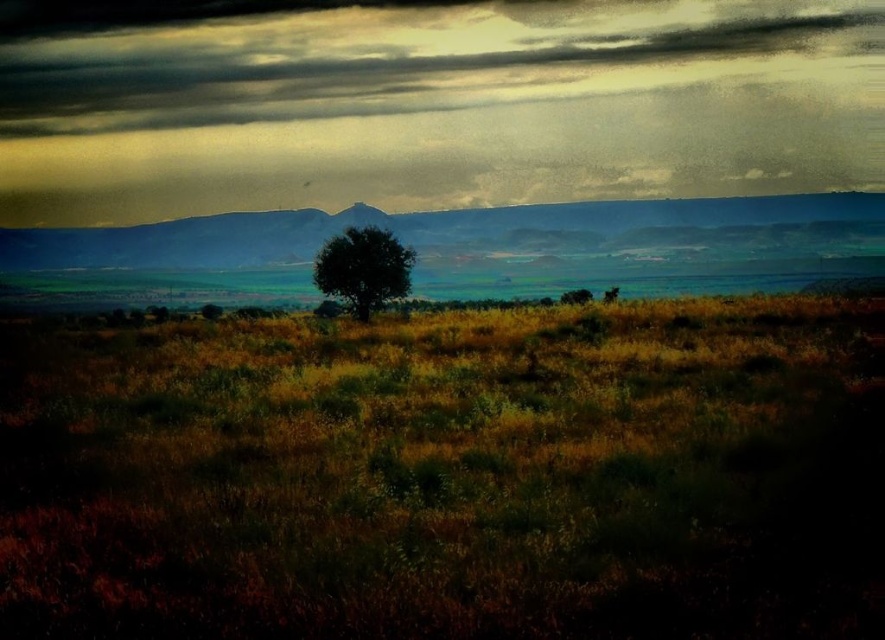
Question: Can you confirm if cloudy textured sky at upper center is positioned to the right of green matte tree at center?

Choices:
 (A) yes
 (B) no

Answer: (B)

Question: Which object is positioned closest to the dull blue mountain at center?

Choices:
 (A) green leafy tree at center
 (B) cloudy textured sky at upper center
 (C) green matte tree at center

Answer: (B)

Question: Can you confirm if cloudy textured sky at upper center is bigger than dull blue mountain at center?

Choices:
 (A) yes
 (B) no

Answer: (A)

Question: Is green leafy tree at center to the right of green matte tree at center from the viewer's perspective?

Choices:
 (A) yes
 (B) no

Answer: (B)

Question: Which point appears closest to the camera in this image?

Choices:
 (A) (368, 225)
 (B) (221, 227)
 (C) (210, 42)

Answer: (A)

Question: Which of the following is the farthest from the observer?

Choices:
 (A) green leafy tree at center
 (B) cloudy textured sky at upper center
 (C) green matte tree at center
 (D) dull blue mountain at center

Answer: (B)